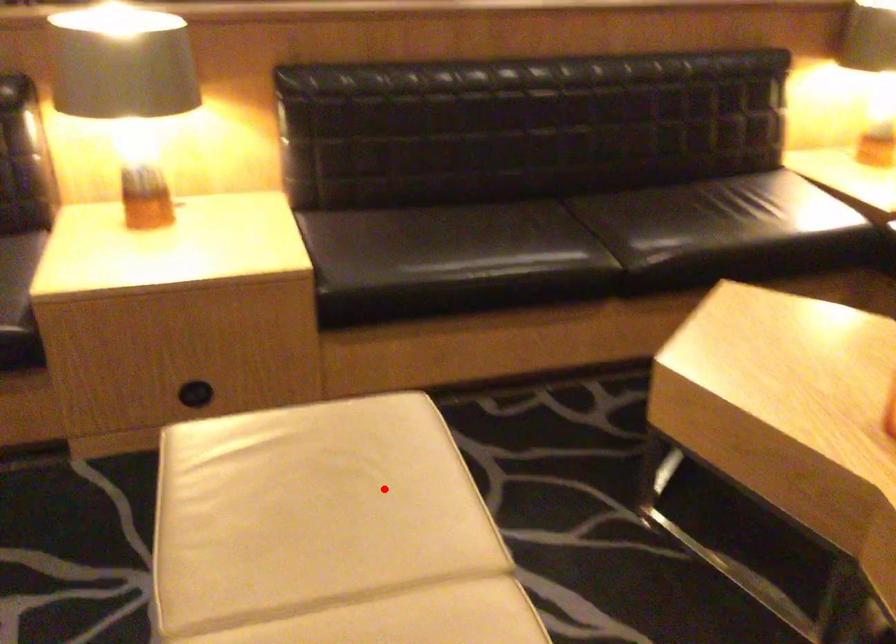
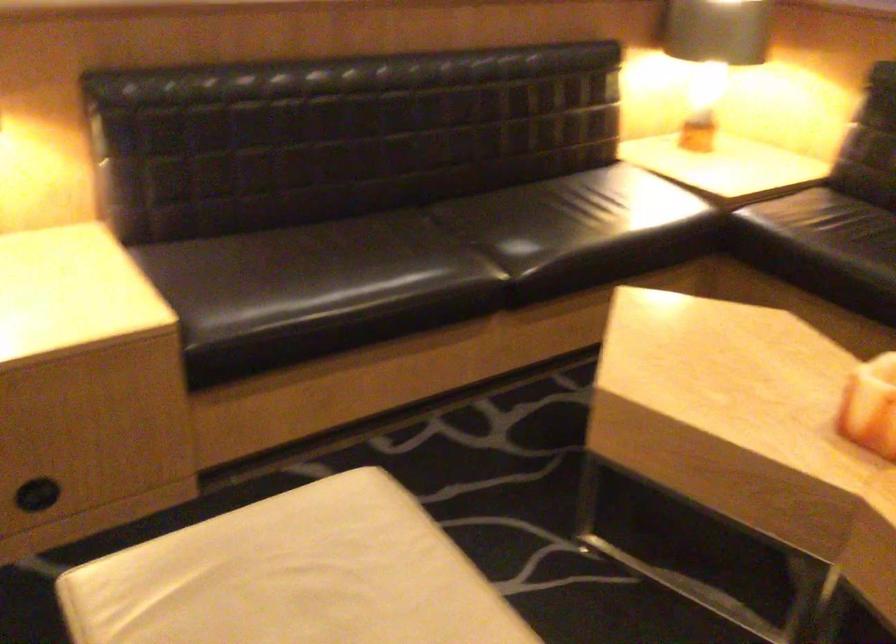
Question: I am providing you with two images of the same scene from different viewpoints. In image1, a red point is highlighted. Considering the same 3D point in image2, which of the following is correct?

Choices:
 (A) It is closer
 (B) It is farther

Answer: (A)